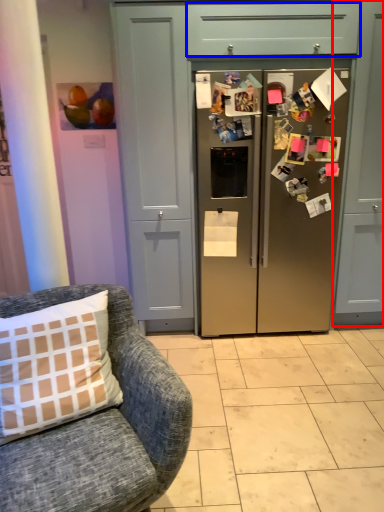
Question: Which point is closer to the camera, cabinetry (highlighted by a red box) or drawer (highlighted by a blue box)?

Choices:
 (A) cabinetry
 (B) drawer

Answer: (B)